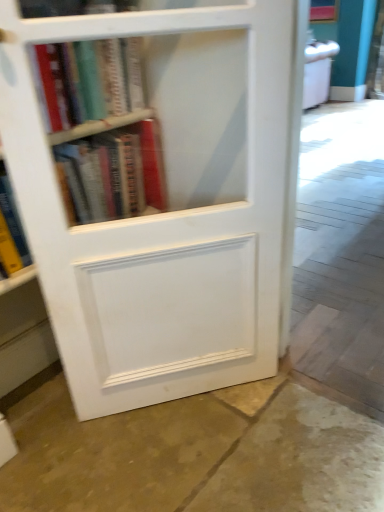
Identify the location of brown stone floor at lower center. The image size is (384, 512). (196, 454).

Identify the location of hardcover books at upper left, which is the 1th book from bottom to top. The width and height of the screenshot is (384, 512). (113, 173).

Describe the element at coordinates (90, 80) in the screenshot. I see `hardcover book at upper left, the second book positioned from the bottom` at that location.

This screenshot has width=384, height=512. Find the location of `white matte bookcase at center`. white matte bookcase at center is located at coordinates (162, 197).

Looking at this image, which object is wider, hardcover books at upper left, which is the 1th book from bottom to top, or brown stone floor at lower center?

brown stone floor at lower center is wider.

Which is farther from the camera, (113, 178) or (257, 502)?

The point (113, 178) is behind.

Which of these two, hardcover books at upper left, placed as the 2th book when sorted from top to bottom, or brown stone floor at lower center, is smaller?

With smaller size is hardcover books at upper left, placed as the 2th book when sorted from top to bottom.

Does brown stone floor at lower center appear on the left side of hardcover book at upper left, the second book positioned from the bottom?

No, brown stone floor at lower center is not to the left of hardcover book at upper left, the second book positioned from the bottom.

Which object is further away from the camera taking this photo, brown stone floor at lower center or hardcover book at upper left, acting as the 1th book starting from the top?

hardcover book at upper left, acting as the 1th book starting from the top, is more distant.

Between brown stone floor at lower center and hardcover book at upper left, the second book positioned from the bottom, which one has smaller width?

With smaller width is hardcover book at upper left, the second book positioned from the bottom.

How much distance is there between brown stone floor at lower center and hardcover book at upper left, acting as the 1th book starting from the top?

brown stone floor at lower center is 98.00 centimeters away from hardcover book at upper left, acting as the 1th book starting from the top.

Is brown stone floor at lower center not close to white matte bookcase at center?

They are positioned close to each other.

Considering the sizes of objects brown stone floor at lower center and white matte bookcase at center in the image provided, who is wider, brown stone floor at lower center or white matte bookcase at center?

brown stone floor at lower center is wider.

From a real-world perspective, who is located higher, brown stone floor at lower center or white matte bookcase at center?

In real-world perspective, white matte bookcase at center is above.

Between point (205, 490) and point (259, 6), which one is positioned behind?

Point (205, 490)

Is hardcover book at upper left, acting as the 1th book starting from the top, thinner than brown stone floor at lower center?

Indeed, hardcover book at upper left, acting as the 1th book starting from the top, has a lesser width compared to brown stone floor at lower center.

From a real-world perspective, is hardcover book at upper left, acting as the 1th book starting from the top, above or below brown stone floor at lower center?

Clearly, from a real-world perspective, hardcover book at upper left, acting as the 1th book starting from the top, is above brown stone floor at lower center.

Which object is further away from the camera, hardcover book at upper left, acting as the 1th book starting from the top, or brown stone floor at lower center?

hardcover book at upper left, acting as the 1th book starting from the top, is further away from the camera.

Considering the sizes of objects hardcover book at upper left, the second book positioned from the bottom, and brown stone floor at lower center in the image provided, who is shorter, hardcover book at upper left, the second book positioned from the bottom, or brown stone floor at lower center?

With less height is brown stone floor at lower center.

From the image's perspective, is white matte bookcase at center located beneath hardcover book at upper left, acting as the 1th book starting from the top?

Indeed, from the image's perspective, white matte bookcase at center is shown beneath hardcover book at upper left, acting as the 1th book starting from the top.

Measure the distance from white matte bookcase at center to hardcover book at upper left, acting as the 1th book starting from the top.

white matte bookcase at center is 11.37 inches away from hardcover book at upper left, acting as the 1th book starting from the top.

Are white matte bookcase at center and hardcover book at upper left, acting as the 1th book starting from the top, located far from each other?

No, white matte bookcase at center is not far from hardcover book at upper left, acting as the 1th book starting from the top.

Consider the image. Between white matte bookcase at center and hardcover book at upper left, the second book positioned from the bottom, which one is positioned in front?

white matte bookcase at center is in front.

Based on the photo, which is in front, brown stone floor at lower center or hardcover books at upper left, placed as the 2th book when sorted from top to bottom?

brown stone floor at lower center is closer to the camera.

Is brown stone floor at lower center oriented away from hardcover books at upper left, placed as the 2th book when sorted from top to bottom?

brown stone floor at lower center does not have its back to hardcover books at upper left, placed as the 2th book when sorted from top to bottom.

From a real-world perspective, is brown stone floor at lower center positioned above or below hardcover books at upper left, placed as the 2th book when sorted from top to bottom?

brown stone floor at lower center is below hardcover books at upper left, placed as the 2th book when sorted from top to bottom.

In terms of size, does brown stone floor at lower center appear bigger or smaller than hardcover books at upper left, which is the 1th book from bottom to top?

Considering their sizes, brown stone floor at lower center takes up more space than hardcover books at upper left, which is the 1th book from bottom to top.

Does point (45, 205) lie behind point (88, 443)?

No, it is in front of (88, 443).

Is brown stone floor at lower center a part of white matte bookcase at center?

No, brown stone floor at lower center is not surrounded by white matte bookcase at center.

Measure the distance between white matte bookcase at center and brown stone floor at lower center.

They are 19.56 inches apart.

At what (x,y) coordinates should I click in order to perform the action: click on the 1st book positioned above the brown stone floor at lower center (from a real-world perspective). Please return your answer as a coordinate pair (x, y). The image size is (384, 512). Looking at the image, I should click on (113, 173).

Find the location of a particular element. This screenshot has width=384, height=512. concrete below the hardcover book at upper left, the second book positioned from the bottom (from the image's perspective) is located at coordinates (196, 454).

Consider the image. Looking at the image, which one is located closer to hardcover book at upper left, acting as the 1th book starting from the top, brown stone floor at lower center or hardcover books at upper left, which is the 1th book from bottom to top?

hardcover books at upper left, which is the 1th book from bottom to top.

From the image, which object appears to be nearer to hardcover books at upper left, which is the 1th book from bottom to top, brown stone floor at lower center or hardcover book at upper left, acting as the 1th book starting from the top?

hardcover book at upper left, acting as the 1th book starting from the top, is closer to hardcover books at upper left, which is the 1th book from bottom to top.

From the image, which object appears to be nearer to white matte bookcase at center, hardcover book at upper left, the second book positioned from the bottom, or hardcover books at upper left, which is the 1th book from bottom to top?

Based on the image, hardcover books at upper left, which is the 1th book from bottom to top, appears to be nearer to white matte bookcase at center.

When comparing their distances from white matte bookcase at center, does hardcover books at upper left, placed as the 2th book when sorted from top to bottom, or hardcover book at upper left, the second book positioned from the bottom, seem further?

hardcover book at upper left, the second book positioned from the bottom.

Looking at the image, which one is located further to hardcover book at upper left, the second book positioned from the bottom, hardcover books at upper left, which is the 1th book from bottom to top, or white matte bookcase at center?

white matte bookcase at center is positioned further to the anchor hardcover book at upper left, the second book positioned from the bottom.

From the image, which object appears to be farther from brown stone floor at lower center, white matte bookcase at center or hardcover books at upper left, placed as the 2th book when sorted from top to bottom?

The object further to brown stone floor at lower center is hardcover books at upper left, placed as the 2th book when sorted from top to bottom.

Estimate the real-world distances between objects in this image. Which object is further from hardcover book at upper left, the second book positioned from the bottom, hardcover books at upper left, placed as the 2th book when sorted from top to bottom, or brown stone floor at lower center?

brown stone floor at lower center lies further to hardcover book at upper left, the second book positioned from the bottom, than the other object.

Based on their spatial positions, is hardcover book at upper left, the second book positioned from the bottom, or brown stone floor at lower center further from white matte bookcase at center?

The object further to white matte bookcase at center is brown stone floor at lower center.

Where is `book that lies between hardcover book at upper left, acting as the 1th book starting from the top, and white matte bookcase at center from top to bottom`? book that lies between hardcover book at upper left, acting as the 1th book starting from the top, and white matte bookcase at center from top to bottom is located at coordinates (113, 173).

Locate an element on the screen. book that lies between hardcover book at upper left, acting as the 1th book starting from the top, and brown stone floor at lower center from top to bottom is located at coordinates (113, 173).

Where is `bookcase that lies between hardcover book at upper left, acting as the 1th book starting from the top, and brown stone floor at lower center from top to bottom`? The height and width of the screenshot is (512, 384). bookcase that lies between hardcover book at upper left, acting as the 1th book starting from the top, and brown stone floor at lower center from top to bottom is located at coordinates (162, 197).

Where is `bookcase between hardcover books at upper left, which is the 1th book from bottom to top, and brown stone floor at lower center, in the vertical direction`? This screenshot has height=512, width=384. bookcase between hardcover books at upper left, which is the 1th book from bottom to top, and brown stone floor at lower center, in the vertical direction is located at coordinates pos(162,197).